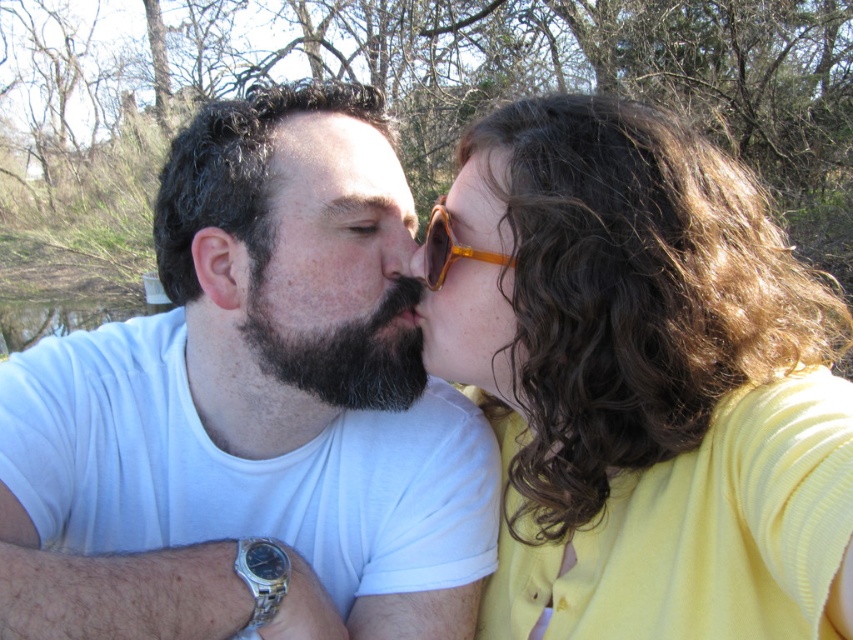
Consider the image. Which of these two, translucent amber sunglasses at center or matte brown nose at center, stands shorter?

matte brown nose at center is shorter.

Measure the distance between translucent amber sunglasses at center and camera.

translucent amber sunglasses at center and camera are 3.47 feet apart from each other.

Describe the element at coordinates (450, 248) in the screenshot. This screenshot has width=853, height=640. I see `translucent amber sunglasses at center` at that location.

You are a GUI agent. You are given a task and a screenshot of the screen. Output one action in this format:
    pyautogui.click(x=<x>, y=<y>)
    Task: Click on the translucent amber sunglasses at center
    The width and height of the screenshot is (853, 640).
    Given the screenshot: What is the action you would take?
    pyautogui.click(x=450, y=248)

From the picture: Does white matte t-shirt at center appear under orange matte sunglasses at center?

Yes, white matte t-shirt at center is below orange matte sunglasses at center.

Which is above, white matte t-shirt at center or orange matte sunglasses at center?

orange matte sunglasses at center

Describe the element at coordinates (248, 422) in the screenshot. This screenshot has height=640, width=853. I see `white matte t-shirt at center` at that location.

Where is `white matte t-shirt at center`? Image resolution: width=853 pixels, height=640 pixels. white matte t-shirt at center is located at coordinates (248, 422).

Does dark brown fuzzy beard at center lie in front of matte brown nose at center?

That is True.

Can you confirm if dark brown fuzzy beard at center is smaller than matte brown nose at center?

Incorrect, dark brown fuzzy beard at center is not smaller in size than matte brown nose at center.

This screenshot has width=853, height=640. What do you see at coordinates (344, 349) in the screenshot?
I see `dark brown fuzzy beard at center` at bounding box center [344, 349].

At what (x,y) coordinates should I click in order to perform the action: click on dark brown fuzzy beard at center. Please return your answer as a coordinate pair (x, y). This screenshot has height=640, width=853. Looking at the image, I should click on (344, 349).